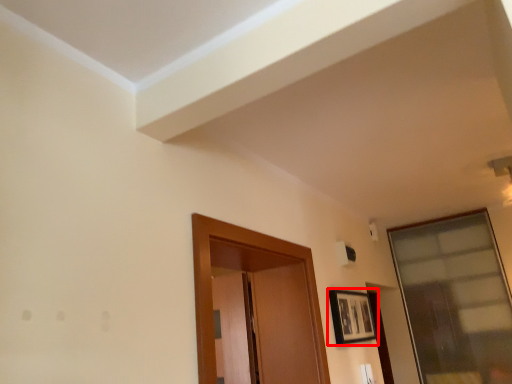
Question: From the image's perspective, what is the correct spatial positioning of picture frame (annotated by the red box) in reference to window?

Choices:
 (A) above
 (B) below

Answer: (A)